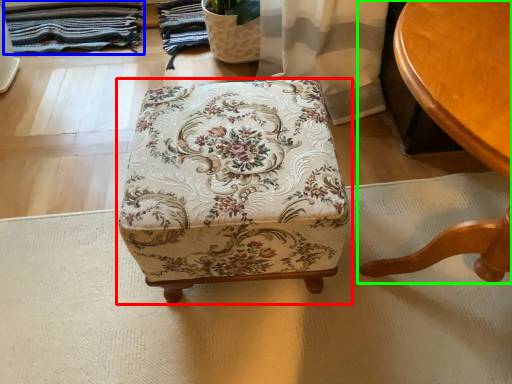
Question: Which object is positioned closest to furniture (highlighted by a red box)? Select from blanket (highlighted by a blue box) and table (highlighted by a green box).

Choices:
 (A) blanket
 (B) table

Answer: (B)